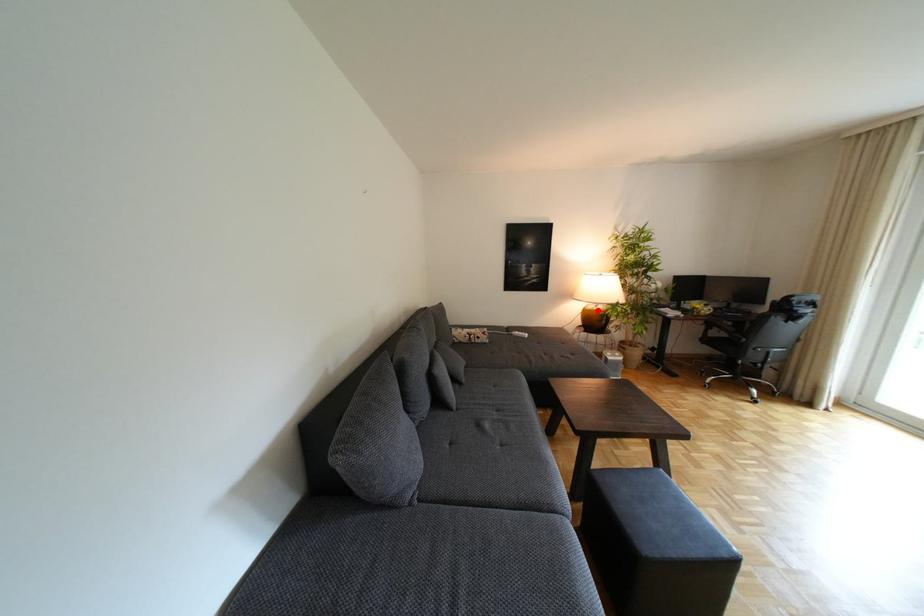
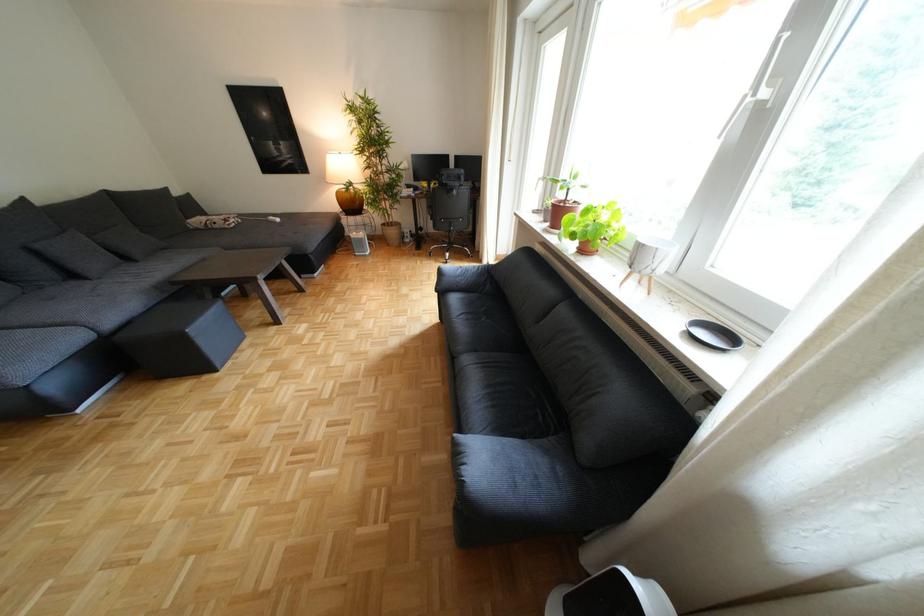
In the second image, find the point that corresponds to the highlighted location in the first image.

(351, 193)